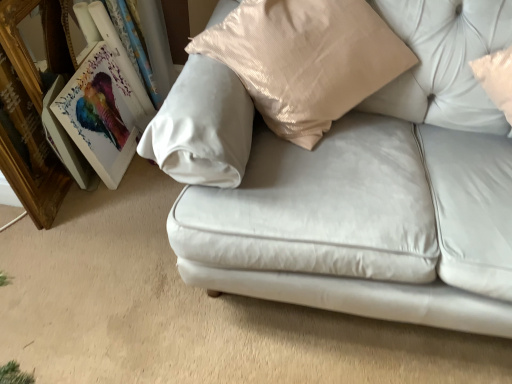
Describe the element at coordinates (369, 207) in the screenshot. I see `satin white couch at center` at that location.

You are a GUI agent. You are given a task and a screenshot of the screen. Output one action in this format:
    pyautogui.click(x=<x>, y=<y>)
    Task: Click on the satin white couch at center
    The width and height of the screenshot is (512, 384).
    Given the screenshot: What is the action you would take?
    pyautogui.click(x=369, y=207)

The height and width of the screenshot is (384, 512). Find the location of `satin white couch at center`. satin white couch at center is located at coordinates (369, 207).

Based on the photo, can you tell me how much matte wooden picture frame at left, which is the first picture frame from right to left, and satin white couch at center differ in facing direction?

There is a 60.1-degree angle between the facing directions of matte wooden picture frame at left, which is the first picture frame from right to left, and satin white couch at center.

Does matte wooden picture frame at left, which is the first picture frame from right to left, touch satin white couch at center?

There is a gap between matte wooden picture frame at left, which is the first picture frame from right to left, and satin white couch at center.

From a real-world perspective, is matte wooden picture frame at left, which ranks as the 2th picture frame in left-to-right order, below satin white couch at center?

Correct, in the physical world, matte wooden picture frame at left, which ranks as the 2th picture frame in left-to-right order, is lower than satin white couch at center.

Considering the points (72, 76) and (472, 170), which point is in front, point (72, 76) or point (472, 170)?

The point (472, 170) is closer.

At what (x,y) coordinates should I click in order to perform the action: click on the 1st picture frame behind when counting from the satin white couch at center. Please return your answer as a coordinate pair (x, y). Looking at the image, I should click on (30, 112).

From a real-world perspective, which object stands above the other?

satin white couch at center is physically above.

Could you tell me if wooden gold picture frame at left, positioned as the 1th picture frame in left-to-right order, is facing satin white couch at center?

Yes, wooden gold picture frame at left, positioned as the 1th picture frame in left-to-right order, is turned towards satin white couch at center.

From the image's perspective, would you say wooden gold picture frame at left, positioned as the 1th picture frame in left-to-right order, is shown under satin white couch at center?

Incorrect, from the image's perspective, wooden gold picture frame at left, positioned as the 1th picture frame in left-to-right order, is higher than satin white couch at center.

From a real-world perspective, which is physically above, satin white couch at center or wooden gold picture frame at left, the 2th picture frame when ordered from right to left?

satin white couch at center, from a real-world perspective.

Is satin white couch at center at the right side of wooden gold picture frame at left, the 2th picture frame when ordered from right to left?

Yes.

Based on the photo, considering the relative positions of satin white couch at center and wooden gold picture frame at left, the 2th picture frame when ordered from right to left, in the image provided, is satin white couch at center in front of wooden gold picture frame at left, the 2th picture frame when ordered from right to left,?

Yes, satin white couch at center is closer to the viewer.

Relative to wooden gold picture frame at left, the 2th picture frame when ordered from right to left, is matte wooden picture frame at left, which is the first picture frame from right to left, in front or behind?

Visually, matte wooden picture frame at left, which is the first picture frame from right to left, is located behind wooden gold picture frame at left, the 2th picture frame when ordered from right to left.

Considering the sizes of objects matte wooden picture frame at left, which ranks as the 2th picture frame in left-to-right order, and wooden gold picture frame at left, the 2th picture frame when ordered from right to left, in the image provided, who is bigger, matte wooden picture frame at left, which ranks as the 2th picture frame in left-to-right order, or wooden gold picture frame at left, the 2th picture frame when ordered from right to left,?

wooden gold picture frame at left, the 2th picture frame when ordered from right to left.

Can you tell me how much matte wooden picture frame at left, which ranks as the 2th picture frame in left-to-right order, and wooden gold picture frame at left, the 2th picture frame when ordered from right to left, differ in facing direction?

There is a 0.76-degree angle between the facing directions of matte wooden picture frame at left, which ranks as the 2th picture frame in left-to-right order, and wooden gold picture frame at left, the 2th picture frame when ordered from right to left.

From a real-world perspective, is matte wooden picture frame at left, which ranks as the 2th picture frame in left-to-right order, under wooden gold picture frame at left, positioned as the 1th picture frame in left-to-right order?

Yes, from a real-world perspective, matte wooden picture frame at left, which ranks as the 2th picture frame in left-to-right order, is below wooden gold picture frame at left, positioned as the 1th picture frame in left-to-right order.

Can you confirm if satin white couch at center is wider than matte wooden picture frame at left, which ranks as the 2th picture frame in left-to-right order?

Yes, satin white couch at center is wider than matte wooden picture frame at left, which ranks as the 2th picture frame in left-to-right order.

How different are the orientations of satin white couch at center and matte wooden picture frame at left, which is the first picture frame from right to left, in degrees?

60.1 degrees separate the facing orientations of satin white couch at center and matte wooden picture frame at left, which is the first picture frame from right to left.

From a real-world perspective, is satin white couch at center physically located above or below matte wooden picture frame at left, which is the first picture frame from right to left?

From a real-world perspective, satin white couch at center is physically above matte wooden picture frame at left, which is the first picture frame from right to left.

Which is behind, satin white couch at center or matte wooden picture frame at left, which is the first picture frame from right to left?

matte wooden picture frame at left, which is the first picture frame from right to left, is more distant.

From a real-world perspective, is wooden gold picture frame at left, the 2th picture frame when ordered from right to left, physically located above or below matte wooden picture frame at left, which ranks as the 2th picture frame in left-to-right order?

wooden gold picture frame at left, the 2th picture frame when ordered from right to left, is situated higher than matte wooden picture frame at left, which ranks as the 2th picture frame in left-to-right order, in the real world.

Looking at this image, which is more to the right, wooden gold picture frame at left, positioned as the 1th picture frame in left-to-right order, or matte wooden picture frame at left, which is the first picture frame from right to left?

From the viewer's perspective, matte wooden picture frame at left, which is the first picture frame from right to left, appears more on the right side.

In order to click on picture frame lying on the right of wooden gold picture frame at left, positioned as the 1th picture frame in left-to-right order in this screenshot , I will do `click(101, 115)`.

I want to click on studio couch above the matte wooden picture frame at left, which ranks as the 2th picture frame in left-to-right order (from a real-world perspective), so click(369, 207).

Where is `studio couch on the right of wooden gold picture frame at left, positioned as the 1th picture frame in left-to-right order`? This screenshot has width=512, height=384. studio couch on the right of wooden gold picture frame at left, positioned as the 1th picture frame in left-to-right order is located at coordinates (369, 207).

Which object lies further to the anchor point satin white couch at center, matte wooden picture frame at left, which is the first picture frame from right to left, or wooden gold picture frame at left, positioned as the 1th picture frame in left-to-right order?

wooden gold picture frame at left, positioned as the 1th picture frame in left-to-right order.

Looking at the image, which one is located further to satin white couch at center, wooden gold picture frame at left, the 2th picture frame when ordered from right to left, or matte wooden picture frame at left, which ranks as the 2th picture frame in left-to-right order?

Among the two, wooden gold picture frame at left, the 2th picture frame when ordered from right to left, is located further to satin white couch at center.

Based on their spatial positions, is matte wooden picture frame at left, which ranks as the 2th picture frame in left-to-right order, or satin white couch at center further from wooden gold picture frame at left, positioned as the 1th picture frame in left-to-right order?

satin white couch at center is positioned further to the anchor wooden gold picture frame at left, positioned as the 1th picture frame in left-to-right order.

Considering their positions, is satin white couch at center positioned closer to matte wooden picture frame at left, which is the first picture frame from right to left, than wooden gold picture frame at left, positioned as the 1th picture frame in left-to-right order?

wooden gold picture frame at left, positioned as the 1th picture frame in left-to-right order.

From the image, which object appears to be nearer to matte wooden picture frame at left, which is the first picture frame from right to left, wooden gold picture frame at left, positioned as the 1th picture frame in left-to-right order, or satin white couch at center?

wooden gold picture frame at left, positioned as the 1th picture frame in left-to-right order, is positioned closer to the anchor matte wooden picture frame at left, which is the first picture frame from right to left.

From the image, which object appears to be nearer to wooden gold picture frame at left, positioned as the 1th picture frame in left-to-right order, satin white couch at center or matte wooden picture frame at left, which ranks as the 2th picture frame in left-to-right order?

Based on the image, matte wooden picture frame at left, which ranks as the 2th picture frame in left-to-right order, appears to be nearer to wooden gold picture frame at left, positioned as the 1th picture frame in left-to-right order.

Where is `picture frame between wooden gold picture frame at left, the 2th picture frame when ordered from right to left, and satin white couch at center`? picture frame between wooden gold picture frame at left, the 2th picture frame when ordered from right to left, and satin white couch at center is located at coordinates (101, 115).